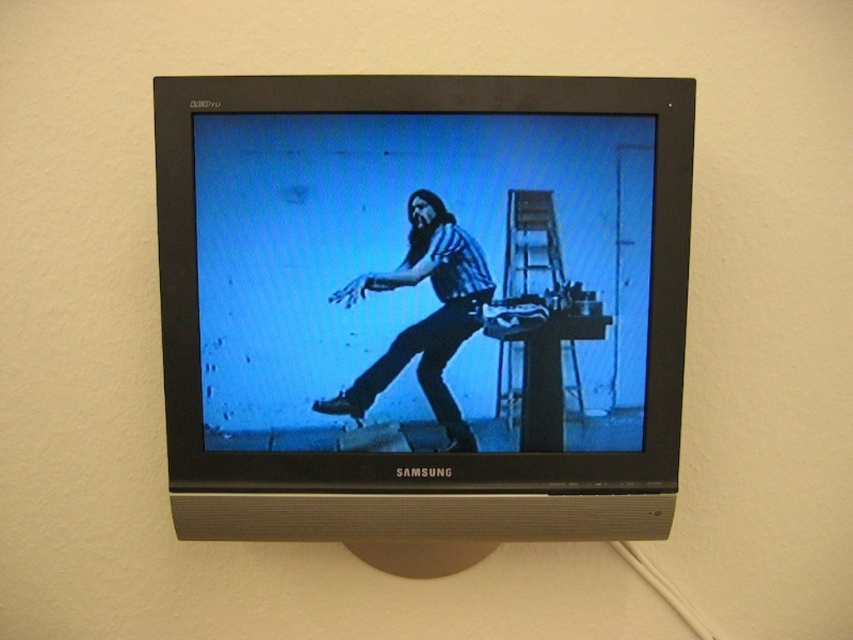
Question: From the image, what is the correct spatial relationship of matte black monitor at center in relation to matte blue jeans at center?

Choices:
 (A) above
 (B) below

Answer: (A)

Question: Can you confirm if matte black monitor at center is wider than matte blue jeans at center?

Choices:
 (A) no
 (B) yes

Answer: (B)

Question: Which point appears farthest from the camera in this image?

Choices:
 (A) (451, 440)
 (B) (288, 429)

Answer: (A)

Question: Which of the following is the farthest from the observer?

Choices:
 (A) matte black monitor at center
 (B) matte blue jeans at center

Answer: (B)

Question: Is matte black monitor at center thinner than matte blue jeans at center?

Choices:
 (A) yes
 (B) no

Answer: (B)